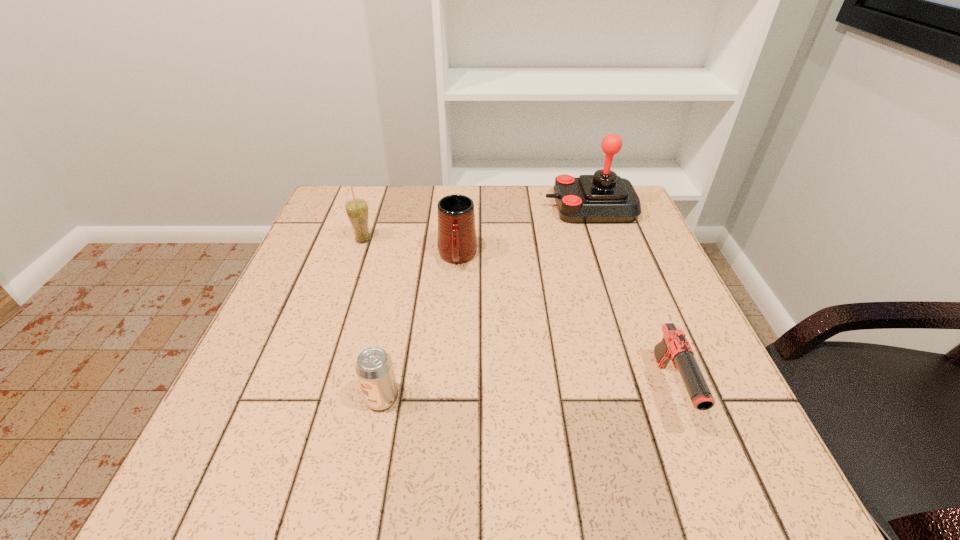
This screenshot has height=540, width=960. In order to click on the farthest object in this screenshot , I will do `click(605, 197)`.

Identify the location of the tallest object. (605, 197).

At what (x,y) coordinates should I click in order to perform the action: click on straw for drinking. Please return your answer as a coordinate pair (x, y). This screenshot has width=960, height=540. Looking at the image, I should click on (357, 210).

The image size is (960, 540). In order to click on the third object from left to right in this screenshot , I will do `click(456, 240)`.

Locate an element on the screen. the third shortest object is located at coordinates (456, 240).

The height and width of the screenshot is (540, 960). In order to click on beer can in this screenshot , I will do `click(374, 368)`.

I want to click on gun, so click(674, 346).

Where is `vacant space located 0.320m on the base of the tallest object`? vacant space located 0.320m on the base of the tallest object is located at coordinates (430, 207).

At what (x,y) coordinates should I click in order to perform the action: click on blank area located 0.150m on the base of the tallest object. Please return your answer as a coordinate pair (x, y). Image resolution: width=960 pixels, height=540 pixels. Looking at the image, I should click on (492, 207).

At what (x,y) coordinates should I click in order to perform the action: click on free space located on the base of the tallest object. Please return your answer as a coordinate pair (x, y). The image size is (960, 540). Looking at the image, I should click on coord(466,207).